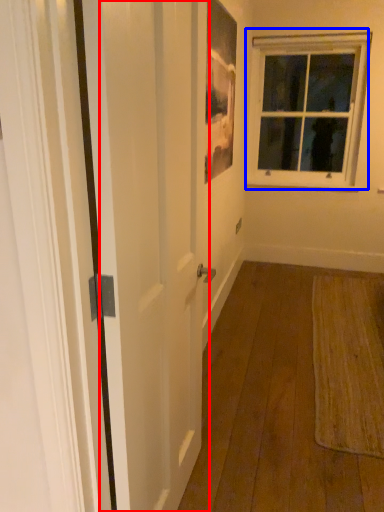
Question: Which object is closer to the camera taking this photo, screen door (highlighted by a red box) or window (highlighted by a blue box)?

Choices:
 (A) screen door
 (B) window

Answer: (A)